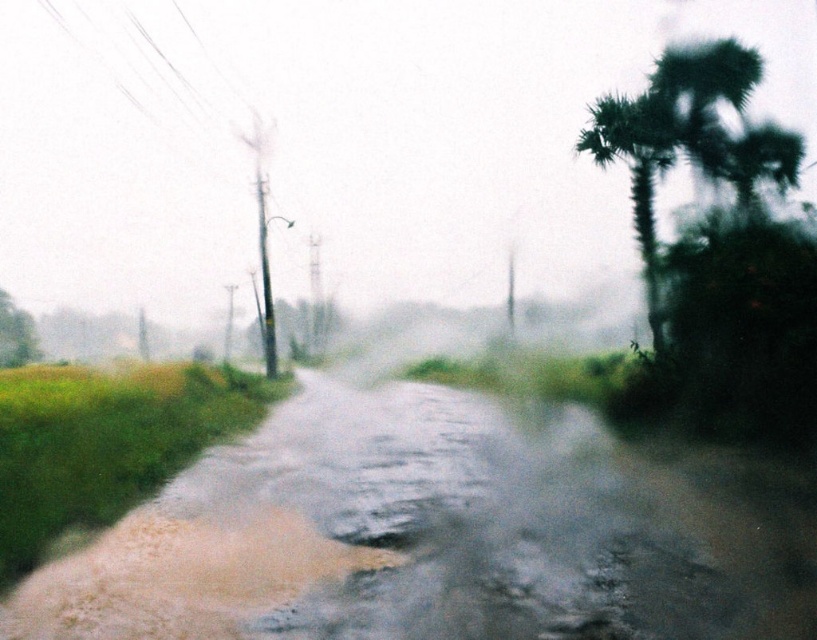
Can you confirm if brown mud at center is positioned below green leafy tree at left?

Yes, brown mud at center is below green leafy tree at left.

Locate an element on the screen. brown mud at center is located at coordinates [418, 538].

Is green leafy palm tree at right further to camera compared to green leafy tree at left?

No, green leafy palm tree at right is closer to the viewer.

What do you see at coordinates (635, 172) in the screenshot? This screenshot has height=640, width=817. I see `green leafy palm tree at right` at bounding box center [635, 172].

Identify the location of green leafy palm tree at right. (635, 172).

The height and width of the screenshot is (640, 817). In order to click on green leafy palm tree at right in this screenshot , I will do `click(635, 172)`.

Does brown mud at center appear under green leafy palm tree at right?

Yes.

Is brown mud at center wider than green leafy palm tree at right?

Incorrect, brown mud at center's width does not surpass green leafy palm tree at right's.

Is point (226, 476) closer to camera compared to point (634, 225)?

Yes, it is in front of point (634, 225).

In order to click on brown mud at center in this screenshot , I will do click(x=418, y=538).